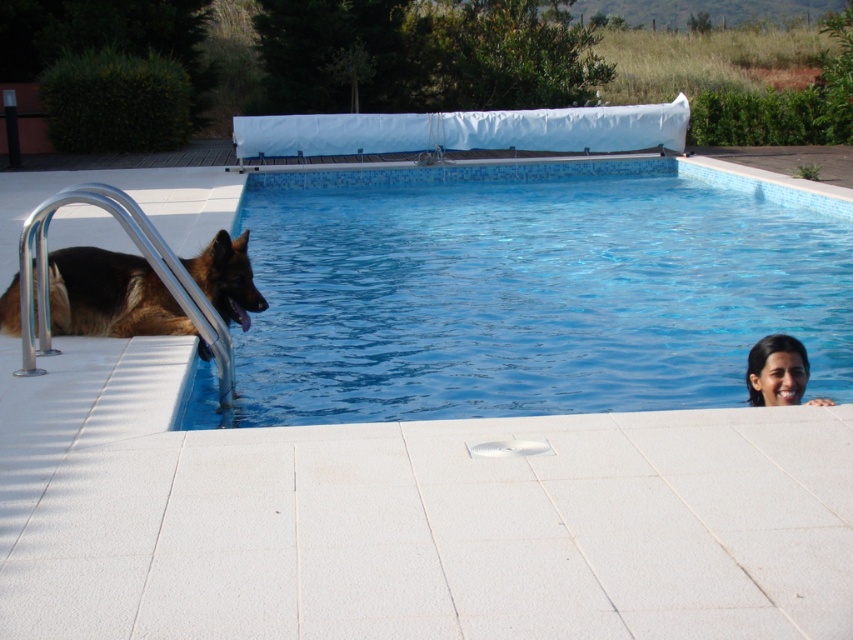
Between blue tile pool at center and smooth skin face at upper right, which one appears on the left side from the viewer's perspective?

blue tile pool at center

Which is in front, point (640, 202) or point (763, 384)?

Point (763, 384)

What do you see at coordinates (531, 289) in the screenshot?
I see `blue tile pool at center` at bounding box center [531, 289].

The image size is (853, 640). In order to click on blue tile pool at center in this screenshot , I will do `click(531, 289)`.

In the scene shown: Is brown fur dog at left shorter than smooth skin face at upper right?

No.

Which is above, brown fur dog at left or smooth skin face at upper right?

brown fur dog at left is above.

Is point (245, 282) positioned in front of point (795, 381)?

No.

Locate an element on the screen. The width and height of the screenshot is (853, 640). brown fur dog at left is located at coordinates (109, 296).

Is point (450, 324) positioned after point (88, 314)?

Yes.

Between blue tile pool at center and brown fur dog at left, which one appears on the right side from the viewer's perspective?

Positioned to the right is blue tile pool at center.

Between point (296, 196) and point (239, 280), which one is positioned behind?

Point (296, 196)

Locate an element on the screen. This screenshot has width=853, height=640. blue tile pool at center is located at coordinates (531, 289).